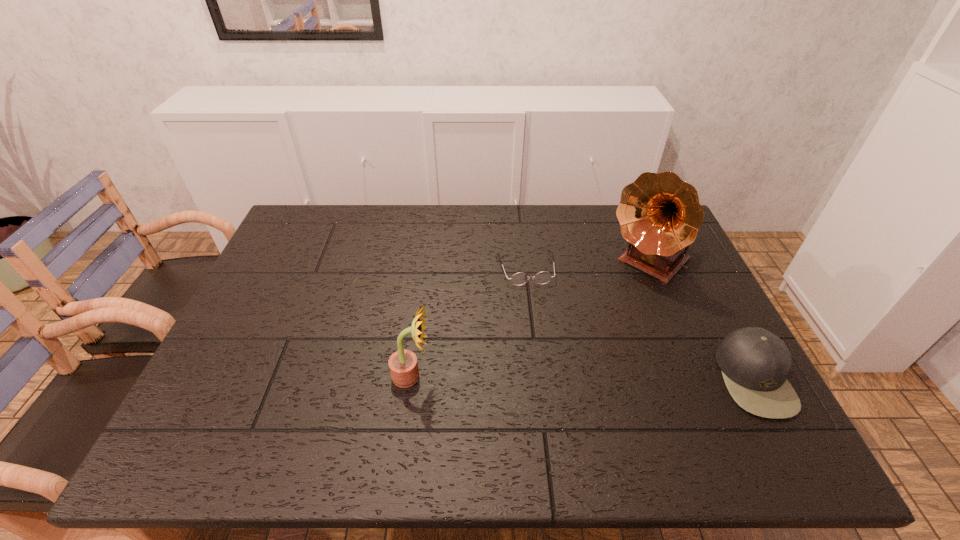
The image size is (960, 540). What are the coordinates of `phonograph_record at the right edge` in the screenshot? It's located at (660, 215).

Where is `object positioned at the far right corner`? This screenshot has height=540, width=960. object positioned at the far right corner is located at coordinates (660, 215).

The width and height of the screenshot is (960, 540). Find the location of `object situated at the near right corner`. object situated at the near right corner is located at coordinates (754, 362).

Locate an element on the screen. Image resolution: width=960 pixels, height=540 pixels. vacant space at the far edge of the desktop is located at coordinates (360, 211).

Find the location of a particular element. Image resolution: width=960 pixels, height=540 pixels. free space at the near edge of the desktop is located at coordinates (667, 390).

Image resolution: width=960 pixels, height=540 pixels. In the image, there is a desktop. Find the location of `vacant space at the left edge`. vacant space at the left edge is located at coordinates (294, 274).

Where is `free space at the right edge of the desktop`? This screenshot has height=540, width=960. free space at the right edge of the desktop is located at coordinates (710, 354).

This screenshot has height=540, width=960. In the image, there is a desktop. Identify the location of vacant space at the far left corner. (314, 204).

The height and width of the screenshot is (540, 960). What are the coordinates of `vacant space at the near left corner of the desktop` in the screenshot? It's located at (227, 397).

At what (x,y) coordinates should I click in order to perform the action: click on vacant area that lies between the third object from right to left and the cap. Please return your answer as a coordinate pair (x, y). Image resolution: width=960 pixels, height=540 pixels. Looking at the image, I should click on (640, 323).